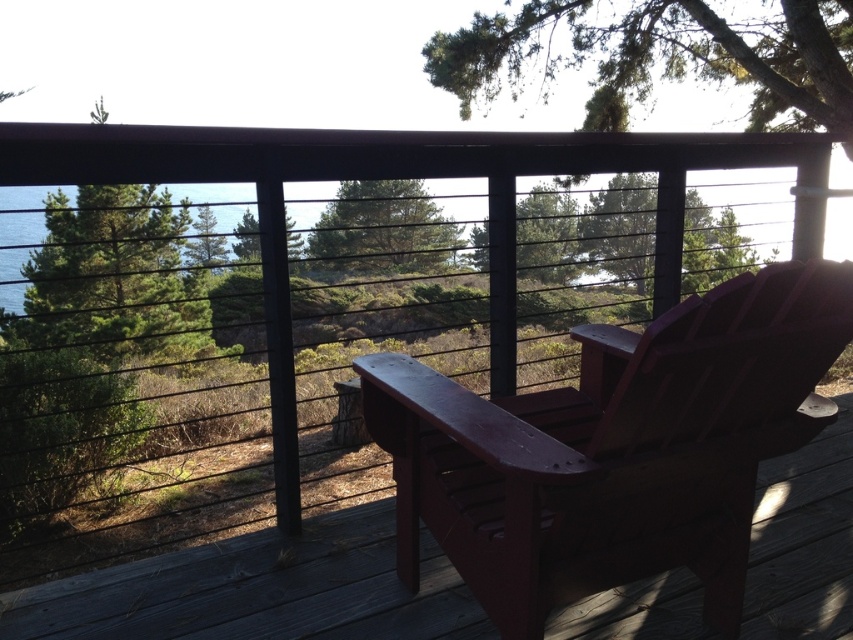
You are standing at the edge of the deck and want to sit down. There is a matte wood chair at center located at point (260, 589). Can you reach the chair without crossing the railing?

Yes, you can reach the matte wood chair at center at point (260, 589) without crossing the railing since it is positioned at the center of the deck, which is within the safe area bounded by the railing.

You are designing a layout for a small garden and need to place the matte wood rocking chair at center and the green leafy tree at upper left. Given their sizes, which object requires more horizontal space in the garden?

The green leafy tree at upper left requires more horizontal space because it has a greater width than the matte wood rocking chair at center.

Consider the image. You are designing a layout for a small balcony and need to place both the matte wood chair at center and the green textured tree at center. Given their sizes, which object should be placed closer to the edge to ensure there is enough space for both?

The green textured tree at center should be placed closer to the edge because it is smaller than the matte wood chair at center, allowing more space for the larger chair.